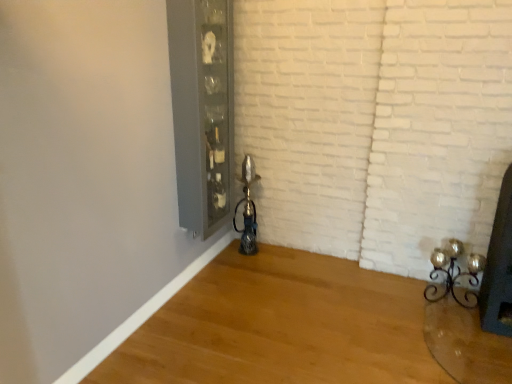
Question: Is gold metallic candle holder at lower right not near clear glass cabinet at upper center?

Choices:
 (A) no
 (B) yes

Answer: (B)

Question: Considering the relative sizes of gold metallic candle holder at lower right and clear glass cabinet at upper center in the image provided, is gold metallic candle holder at lower right wider than clear glass cabinet at upper center?

Choices:
 (A) yes
 (B) no

Answer: (A)

Question: Is gold metallic candle holder at lower right at the right side of clear glass cabinet at upper center?

Choices:
 (A) yes
 (B) no

Answer: (A)

Question: From a real-world perspective, is gold metallic candle holder at lower right positioned over clear glass cabinet at upper center based on gravity?

Choices:
 (A) yes
 (B) no

Answer: (B)

Question: Is gold metallic candle holder at lower right closer to the viewer compared to clear glass cabinet at upper center?

Choices:
 (A) yes
 (B) no

Answer: (B)

Question: From a real-world perspective, is gold metallic candle holder at lower right below clear glass cabinet at upper center?

Choices:
 (A) yes
 (B) no

Answer: (A)

Question: Is clear glass cabinet at upper center next to gold metallic candle holder at lower right?

Choices:
 (A) yes
 (B) no

Answer: (B)

Question: Is clear glass cabinet at upper center at the right side of gold metallic candle holder at lower right?

Choices:
 (A) no
 (B) yes

Answer: (A)

Question: Considering the relative sizes of clear glass cabinet at upper center and gold metallic candle holder at lower right in the image provided, is clear glass cabinet at upper center bigger than gold metallic candle holder at lower right?

Choices:
 (A) no
 (B) yes

Answer: (B)

Question: Is clear glass cabinet at upper center smaller than gold metallic candle holder at lower right?

Choices:
 (A) yes
 (B) no

Answer: (B)

Question: From a real-world perspective, is clear glass cabinet at upper center positioned under gold metallic candle holder at lower right based on gravity?

Choices:
 (A) no
 (B) yes

Answer: (A)

Question: Does clear glass cabinet at upper center have a lesser width compared to gold metallic candle holder at lower right?

Choices:
 (A) no
 (B) yes

Answer: (B)

Question: Is clear glass cabinet at upper center spatially inside gold metallic candle holder at lower right, or outside of it?

Choices:
 (A) inside
 (B) outside

Answer: (B)